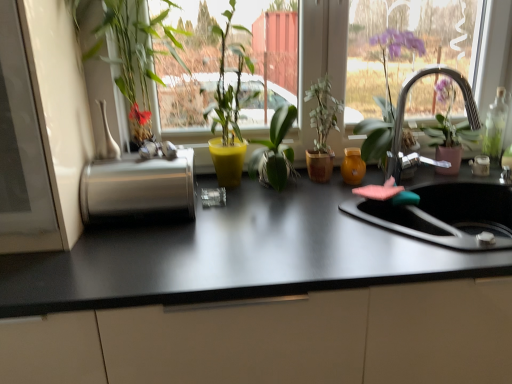
Identify the location of blank space above silver metallic faucet at upper right (from a real-world perspective). (447, 78).